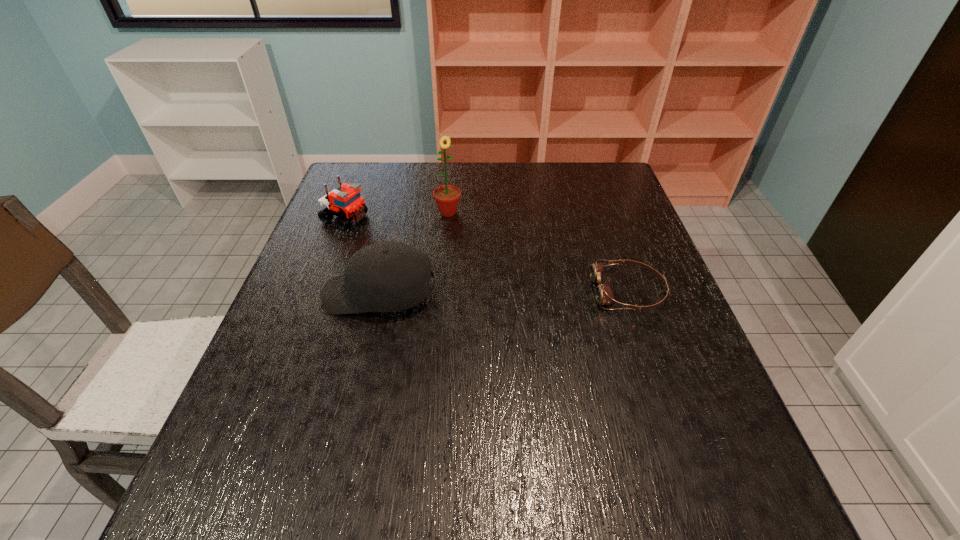
Locate an element on the screen. The height and width of the screenshot is (540, 960). free space on the desktop that is between the baseball cap and the rightmost object and is positioned on the face of the tallest object is located at coordinates (487, 293).

Where is `free space on the desktop that is between the baseball cap and the rightmost object and is positioned on the front-facing side of the Lego`? The height and width of the screenshot is (540, 960). free space on the desktop that is between the baseball cap and the rightmost object and is positioned on the front-facing side of the Lego is located at coordinates (541, 293).